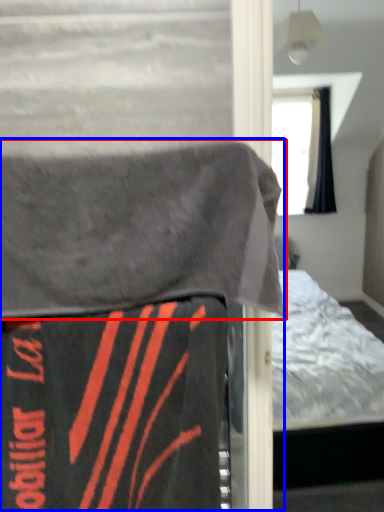
Question: Which object appears closest to the camera in this image, blanket (highlighted by a red box) or bed (highlighted by a blue box)?

Choices:
 (A) blanket
 (B) bed

Answer: (A)